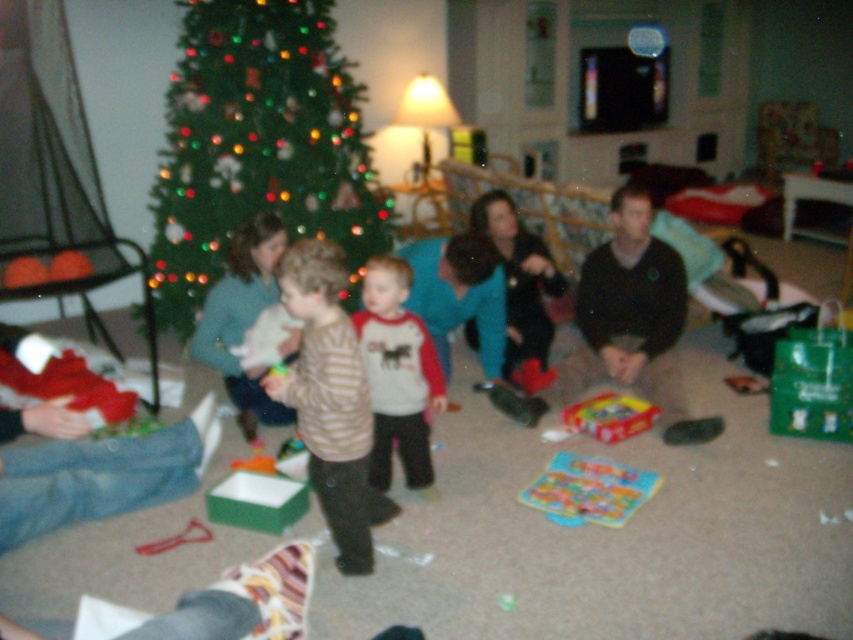
Can you confirm if green matte christmas tree at upper left is bigger than matte plastic board game at lower center?

Yes, green matte christmas tree at upper left is bigger than matte plastic board game at lower center.

What are the coordinates of `green matte christmas tree at upper left` in the screenshot? It's located at (257, 145).

This screenshot has width=853, height=640. I want to click on green matte christmas tree at upper left, so click(x=257, y=145).

Does striped cotton shirt at center come in front of matte plastic board game at lower center?

Yes, it is.

Does point (376, 429) come in front of point (602, 486)?

Yes.

Is point (427, 484) positioned after point (650, 488)?

Yes, point (427, 484) is behind point (650, 488).

Locate an element on the screen. The height and width of the screenshot is (640, 853). striped cotton shirt at center is located at coordinates (397, 372).

Looking at this image, can you confirm if striped sweater at center is positioned above black sweater at center?

No.

Identify the location of striped sweater at center. This screenshot has width=853, height=640. (329, 400).

Describe the element at coordinates (329, 400) in the screenshot. I see `striped sweater at center` at that location.

Identify the location of striped sweater at center. coord(329,400).